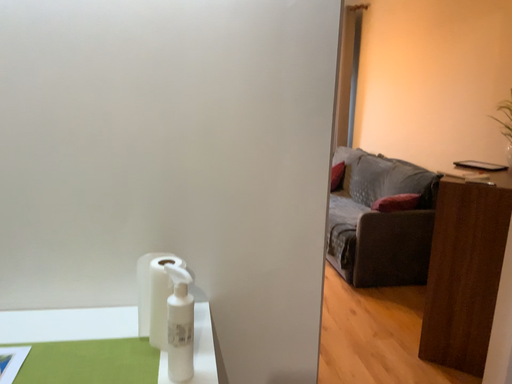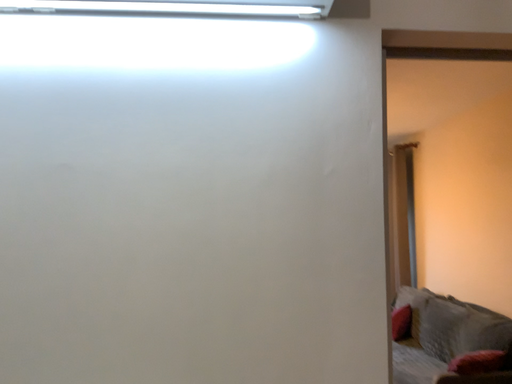
Question: How did the camera likely rotate when shooting the video?

Choices:
 (A) rotated right
 (B) rotated left

Answer: (B)